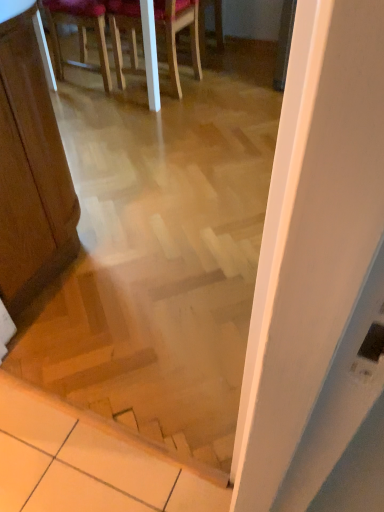
Question: Considering the relative positions of wooden stairs at center and wooden chair at upper center, the first chair when ordered from right to left, in the image provided, is wooden stairs at center to the left or to the right of wooden chair at upper center, the first chair when ordered from right to left,?

Choices:
 (A) right
 (B) left

Answer: (B)

Question: From a real-world perspective, is wooden stairs at center above or below wooden chair at upper center, the first chair when ordered from right to left?

Choices:
 (A) below
 (B) above

Answer: (B)

Question: Estimate the real-world distances between objects in this image. Which object is farther from the wooden stairs at center?

Choices:
 (A) wooden chair at upper center, the 2th chair from the left
 (B) wooden chair at upper center, which is the 1th chair in left-to-right order

Answer: (B)

Question: Which object is positioned closest to the wooden chair at upper center, which is the 1th chair in left-to-right order?

Choices:
 (A) wooden stairs at center
 (B) wooden chair at upper center, the 2th chair from the left

Answer: (B)